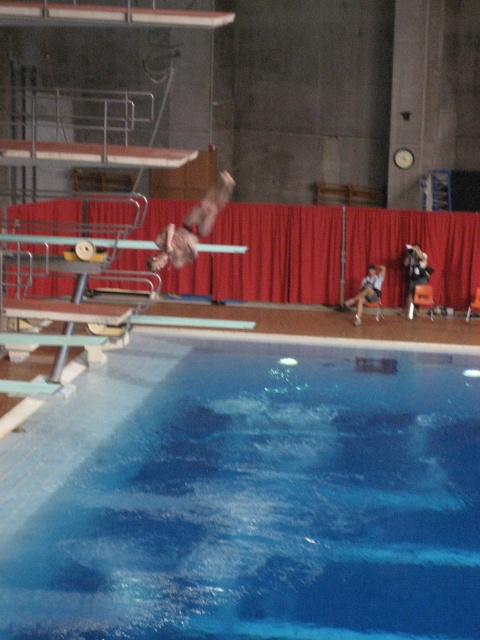
You are a swimmer preparing for a competition and notice the red velvet curtain at center and the brown leather jacket at center in the pool area. Which object is lower in height?

The red velvet curtain at center is shorter than the brown leather jacket at center, so the red velvet curtain at center is lower in height.

You are standing at the edge of the pool and want to know how far you are from the point marked at coordinates point [243,576]. Can you determine the distance?

The point [243,576] is 6.89 meters away from the viewer, so the distance is 6.89 meters.